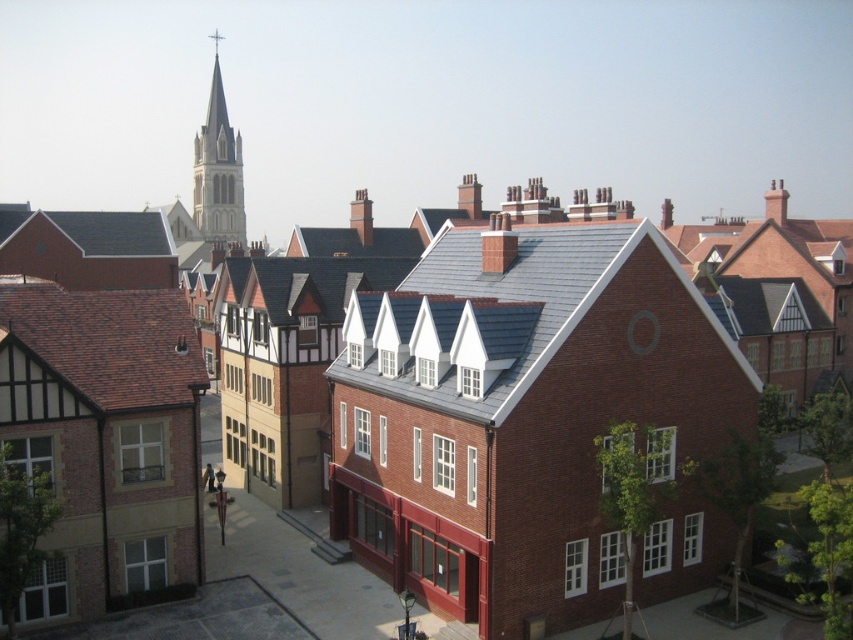
Question: Which point appears closest to the camera in this image?

Choices:
 (A) (131, 228)
 (B) (216, 33)

Answer: (A)

Question: Which of the following is the closest to the observer?

Choices:
 (A) smooth white stone spire at upper center
 (B) gray slate roof at center

Answer: (B)

Question: Is brown tile roof at left to the right of gray slate roof at upper left from the viewer's perspective?

Choices:
 (A) yes
 (B) no

Answer: (A)

Question: Does brown tile roof at left have a larger size compared to white stone steeple at upper left?

Choices:
 (A) no
 (B) yes

Answer: (A)

Question: Is gray slate roof at center thinner than smooth white stone spire at upper center?

Choices:
 (A) no
 (B) yes

Answer: (B)

Question: Which point is farther from the camera taking this photo?

Choices:
 (A) (578, 282)
 (B) (416, 273)
 (C) (122, 250)
 (D) (218, 40)

Answer: (D)